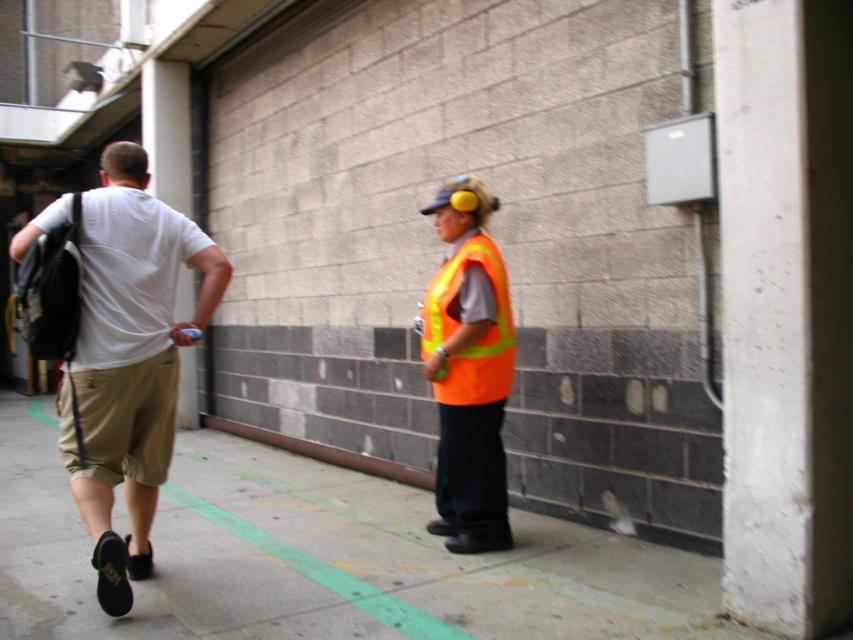
Question: Which point is closer to the camera?

Choices:
 (A) concrete sidewalk at center
 (B) high-visibility orange safety vest at center
 (C) white cotton t-shirt at left

Answer: (A)

Question: Among these objects, which one is farthest from the camera?

Choices:
 (A) high-visibility reflective vest at center
 (B) white cotton t-shirt at left
 (C) khaki cotton shorts at left
 (D) concrete sidewalk at center

Answer: (A)

Question: Is concrete sidewalk at center closer to camera compared to high-visibility orange safety vest at center?

Choices:
 (A) yes
 (B) no

Answer: (A)

Question: Which of the following is the closest to the observer?

Choices:
 (A) (474, 193)
 (B) (376, 604)
 (C) (479, 376)

Answer: (B)

Question: Is concrete sidewalk at center behind white cotton t-shirt at left?

Choices:
 (A) yes
 (B) no

Answer: (B)

Question: Does white cotton t-shirt at left have a larger size compared to high-visibility reflective vest at center?

Choices:
 (A) no
 (B) yes

Answer: (B)